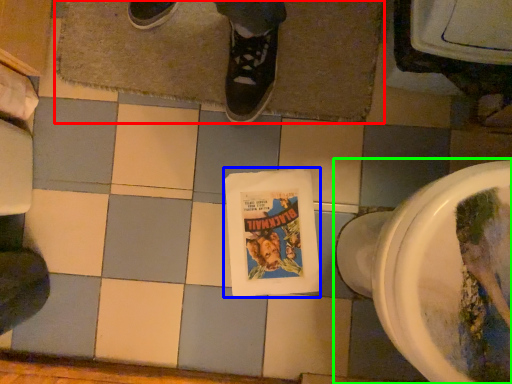
Question: Based on their relative distances, which object is farther from bath mat (highlighted by a red box)? Choose from comic book (highlighted by a blue box) and toilet (highlighted by a green box).

Choices:
 (A) comic book
 (B) toilet

Answer: (B)